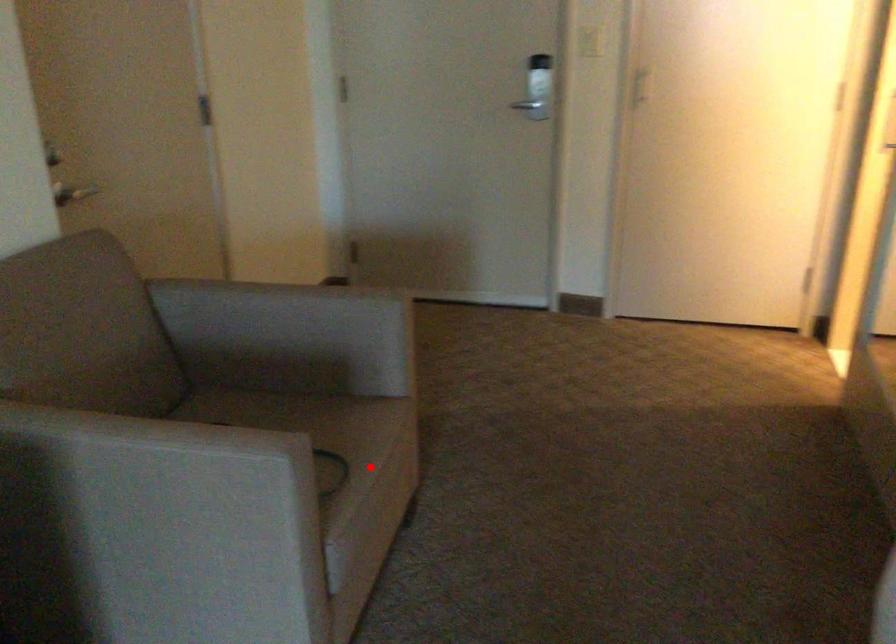
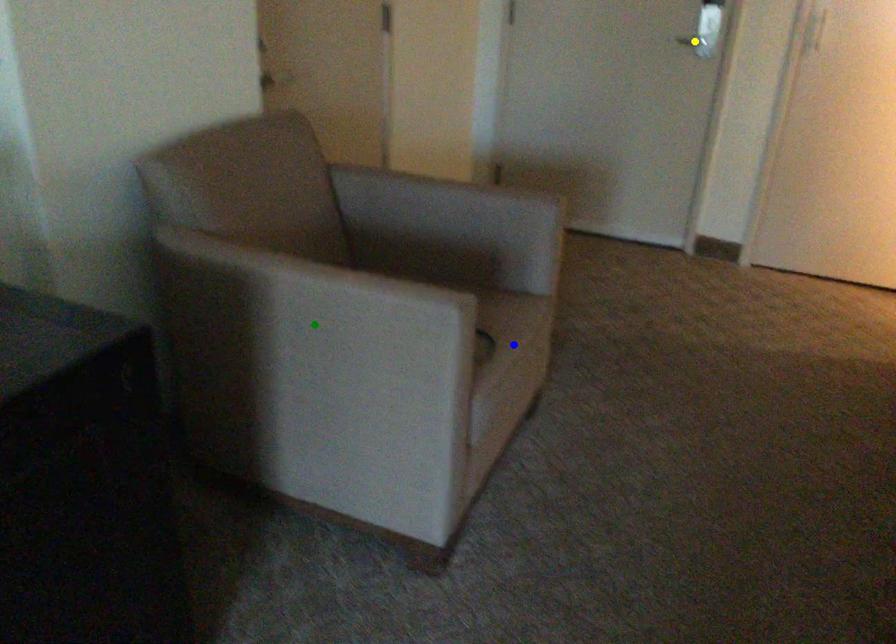
Question: I am providing you with two images of the same scene from different viewpoints. A red point is marked on the first image. You are given multiple points on the second image. In image 2, which mark is for the same physical point as the one in image 1?

Choices:
 (A) yellow point
 (B) green point
 (C) blue point

Answer: (C)